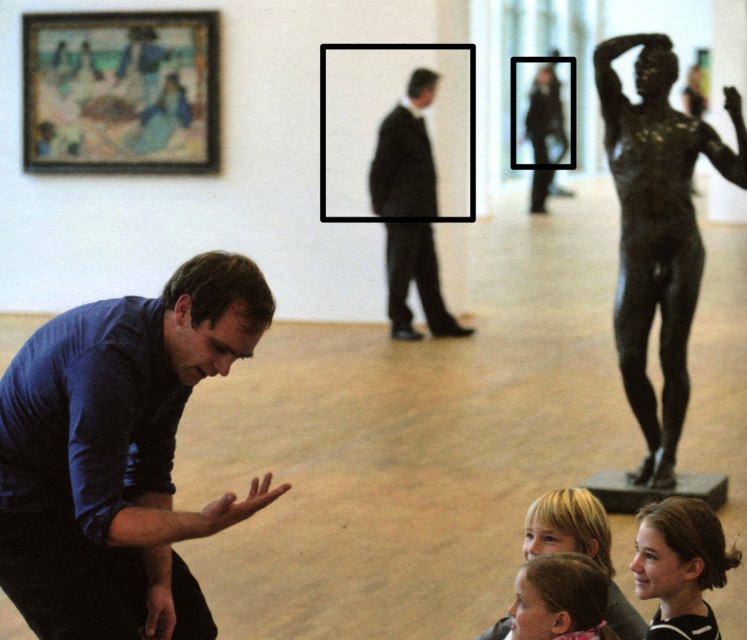
What do you see at coordinates (117, 454) in the screenshot?
I see `blue matte shirt at lower left` at bounding box center [117, 454].

The height and width of the screenshot is (640, 747). I want to click on blue matte shirt at lower left, so click(x=117, y=454).

Between point (734, 100) and point (601, 563), which one is positioned behind?

The point (734, 100) is more distant.

In the scene shown: Between bronze statue at right and blonde hair at lower center, which one has less height?

blonde hair at lower center

Who is more forward, [627,189] or [595,538]?

Point [595,538] is more forward.

Locate an element on the screen. This screenshot has height=640, width=747. bronze statue at right is located at coordinates (x=657, y=230).

Looking at this image, is blue matte shirt at lower left wider than blonde hair at lower center?

Yes.

Is blue matte shirt at lower left in front of blonde hair at lower center?

Yes, it is in front of blonde hair at lower center.

Is point (37, 573) behind point (583, 531)?

No.

The width and height of the screenshot is (747, 640). I want to click on blue matte shirt at lower left, so click(x=117, y=454).